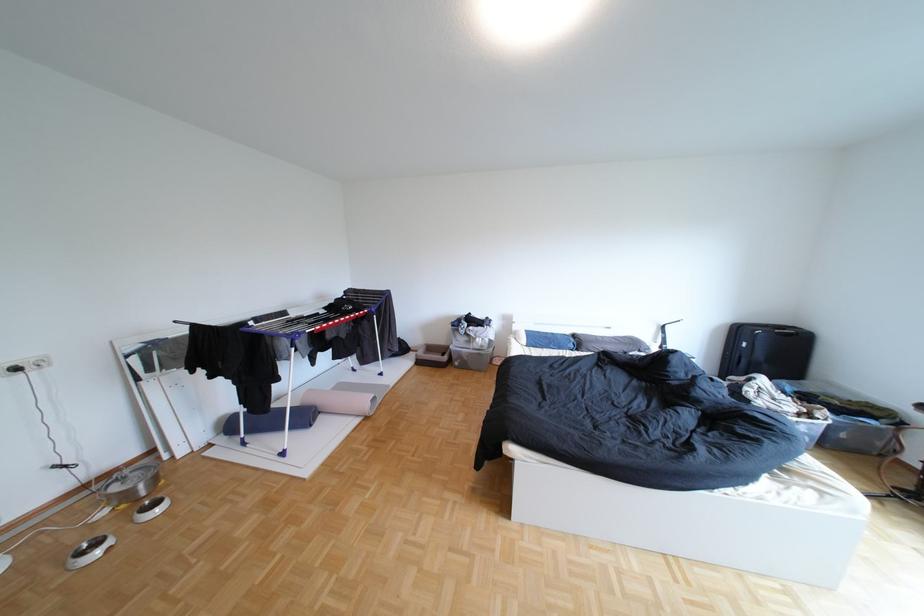
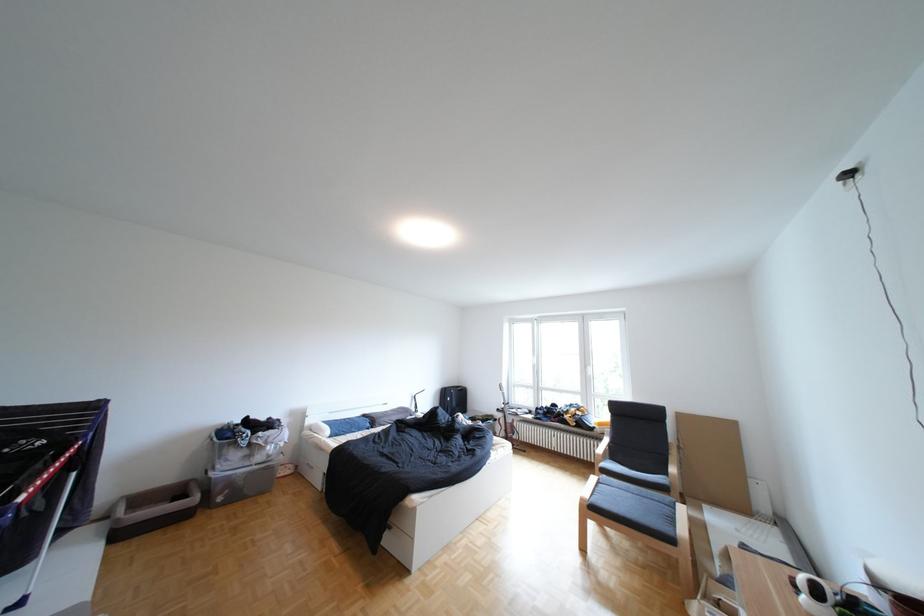
In the second image, find the point that corresponds to [754,331] in the first image.

(459, 392)